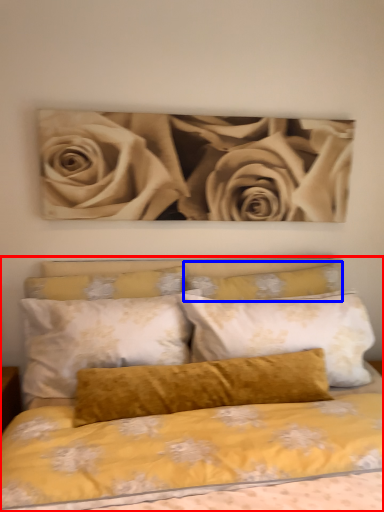
Question: Which object is further to the camera taking this photo, bed (highlighted by a red box) or pillow (highlighted by a blue box)?

Choices:
 (A) bed
 (B) pillow

Answer: (B)